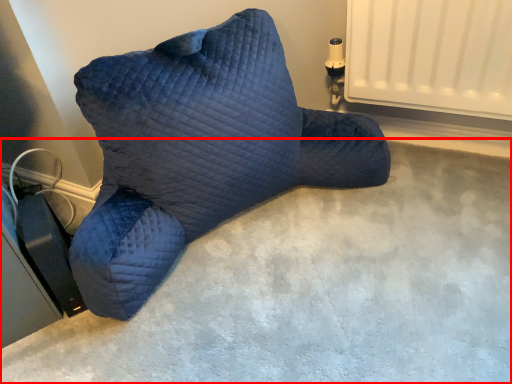
Question: In this image, where is concrete (annotated by the red box) located relative to furniture?

Choices:
 (A) left
 (B) right

Answer: (A)